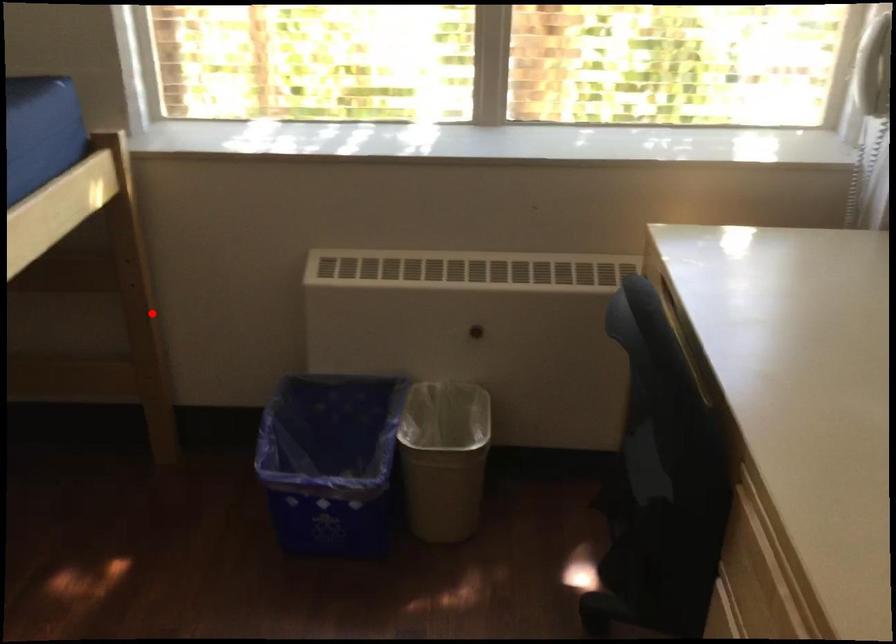
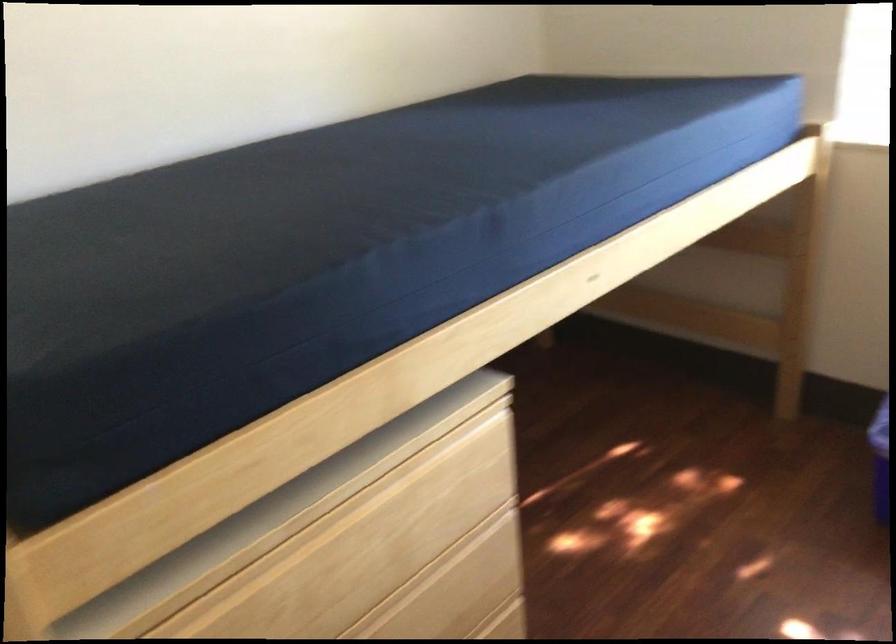
The point at the highlighted location is marked in the first image. Where is the corresponding point in the second image?

(803, 275)